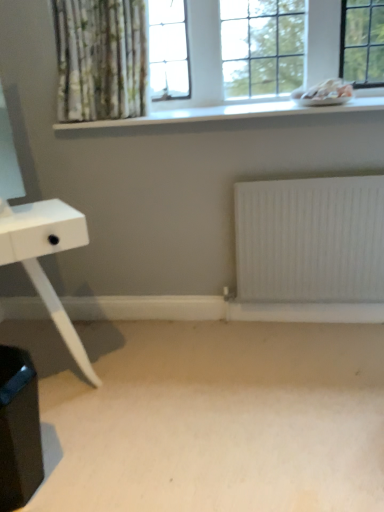
Question: Considering the relative sizes of beige carpet at lower center and white matte radiator at lower center in the image provided, is beige carpet at lower center thinner than white matte radiator at lower center?

Choices:
 (A) yes
 (B) no

Answer: (B)

Question: Is beige carpet at lower center looking in the opposite direction of white matte radiator at lower center?

Choices:
 (A) yes
 (B) no

Answer: (B)

Question: From the image's perspective, is beige carpet at lower center under white matte radiator at lower center?

Choices:
 (A) yes
 (B) no

Answer: (A)

Question: From the image's perspective, is beige carpet at lower center over white matte radiator at lower center?

Choices:
 (A) no
 (B) yes

Answer: (A)

Question: Can you confirm if beige carpet at lower center is positioned to the right of white matte radiator at lower center?

Choices:
 (A) yes
 (B) no

Answer: (B)

Question: From the image's perspective, is white smooth window sill at upper center located above or below white glass window at upper center?

Choices:
 (A) above
 (B) below

Answer: (B)

Question: Relative to white glass window at upper center, is white smooth window sill at upper center in front or behind?

Choices:
 (A) behind
 (B) front

Answer: (B)

Question: Considering the positions of white smooth window sill at upper center and white glass window at upper center in the image, is white smooth window sill at upper center wider or thinner than white glass window at upper center?

Choices:
 (A) wide
 (B) thin

Answer: (A)

Question: Is white smooth window sill at upper center spatially inside white glass window at upper center, or outside of it?

Choices:
 (A) outside
 (B) inside

Answer: (A)

Question: Would you say white glass window at upper center is to the left or to the right of beige carpet at lower center in the picture?

Choices:
 (A) left
 (B) right

Answer: (B)

Question: Is white glass window at upper center in front of or behind beige carpet at lower center in the image?

Choices:
 (A) behind
 (B) front

Answer: (A)

Question: Looking at the image, does white glass window at upper center seem bigger or smaller compared to beige carpet at lower center?

Choices:
 (A) big
 (B) small

Answer: (B)

Question: Is white glass window at upper center wider or thinner than beige carpet at lower center?

Choices:
 (A) thin
 (B) wide

Answer: (A)

Question: From the image's perspective, is beige carpet at lower center above or below white smooth window sill at upper center?

Choices:
 (A) above
 (B) below

Answer: (B)

Question: From a real-world perspective, is beige carpet at lower center above or below white smooth window sill at upper center?

Choices:
 (A) above
 (B) below

Answer: (B)